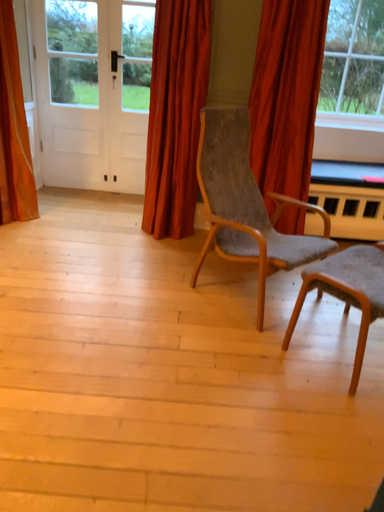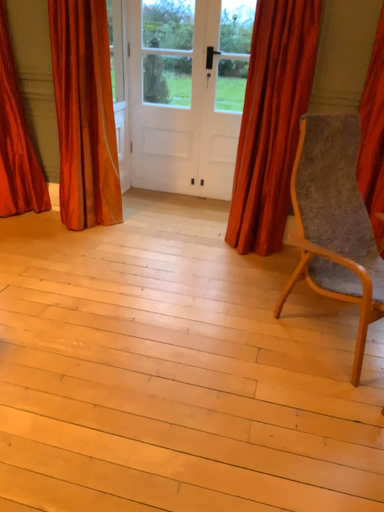
Question: Which way did the camera rotate in the video?

Choices:
 (A) rotated right
 (B) rotated left

Answer: (B)